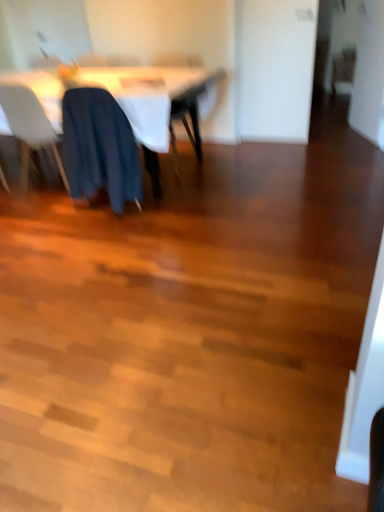
Question: Can you confirm if dark blue fabric at center, the fourth chair viewed from the back, is taller than white plastic chair at left, marked as the first chair in a left-to-right arrangement?

Choices:
 (A) yes
 (B) no

Answer: (B)

Question: Is dark blue fabric at center, the 3th chair from the right, beside white plastic chair at left, positioned as the third chair in back-to-front order?

Choices:
 (A) yes
 (B) no

Answer: (B)

Question: Does dark blue fabric at center, the fourth chair viewed from the back, have a lesser height compared to white plastic chair at left, marked as the first chair in a left-to-right arrangement?

Choices:
 (A) no
 (B) yes

Answer: (B)

Question: Does dark blue fabric at center, the first chair viewed from the front, turn towards white plastic chair at left, placed as the 4th chair when sorted from right to left?

Choices:
 (A) no
 (B) yes

Answer: (A)

Question: From the image's perspective, is dark blue fabric at center, acting as the second chair starting from the left, on top of white plastic chair at left, marked as the first chair in a left-to-right arrangement?

Choices:
 (A) yes
 (B) no

Answer: (B)

Question: In terms of height, does white plastic chair at left, marked as the first chair in a left-to-right arrangement, look taller or shorter compared to white fabric table at upper left?

Choices:
 (A) tall
 (B) short

Answer: (A)

Question: Considering the positions of white plastic chair at left, marked as the first chair in a left-to-right arrangement, and white fabric table at upper left in the image, is white plastic chair at left, marked as the first chair in a left-to-right arrangement, wider or thinner than white fabric table at upper left?

Choices:
 (A) wide
 (B) thin

Answer: (B)

Question: Is white plastic chair at left, placed as the 4th chair when sorted from right to left, spatially inside white fabric table at upper left, or outside of it?

Choices:
 (A) inside
 (B) outside

Answer: (A)

Question: From the image's perspective, is white plastic chair at left, placed as the 4th chair when sorted from right to left, above or below white fabric table at upper left?

Choices:
 (A) above
 (B) below

Answer: (B)

Question: Considering the positions of dark blue fabric chair at center, acting as the second chair starting from the right, and wooden chair at upper right, which is counted as the first chair, starting from the back, in the image, is dark blue fabric chair at center, acting as the second chair starting from the right, bigger or smaller than wooden chair at upper right, which is counted as the first chair, starting from the back,?

Choices:
 (A) small
 (B) big

Answer: (B)

Question: Does point (190, 56) appear closer or farther from the camera than point (347, 88)?

Choices:
 (A) farther
 (B) closer

Answer: (B)

Question: Looking at their shapes, would you say dark blue fabric chair at center, acting as the third chair starting from the left, is wider or thinner than wooden chair at upper right, which ranks as the fourth chair in left-to-right order?

Choices:
 (A) wide
 (B) thin

Answer: (A)

Question: From the image's perspective, is dark blue fabric chair at center, positioned as the third chair in front-to-back order, above or below wooden chair at upper right, which ranks as the fourth chair in left-to-right order?

Choices:
 (A) below
 (B) above

Answer: (A)

Question: In the image, is wooden chair at upper right, which is counted as the first chair, starting from the back, positioned in front of or behind white plastic chair at left, positioned as the third chair in back-to-front order?

Choices:
 (A) front
 (B) behind

Answer: (B)

Question: From a real-world perspective, is wooden chair at upper right, the fourth chair from the front, physically located above or below white plastic chair at left, marked as the first chair in a left-to-right arrangement?

Choices:
 (A) above
 (B) below

Answer: (B)